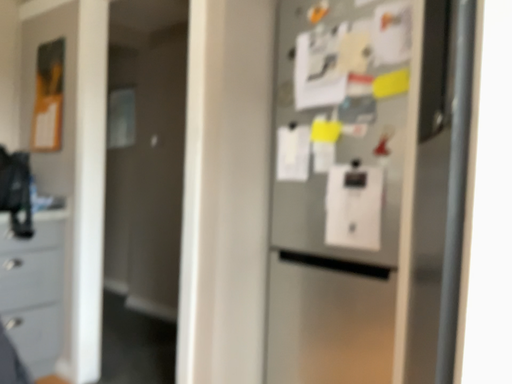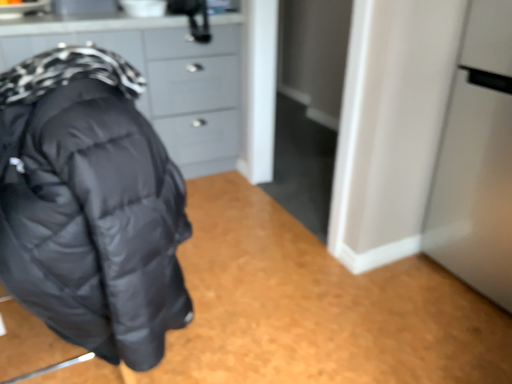
Question: How did the camera likely rotate when shooting the video?

Choices:
 (A) rotated right
 (B) rotated left

Answer: (B)